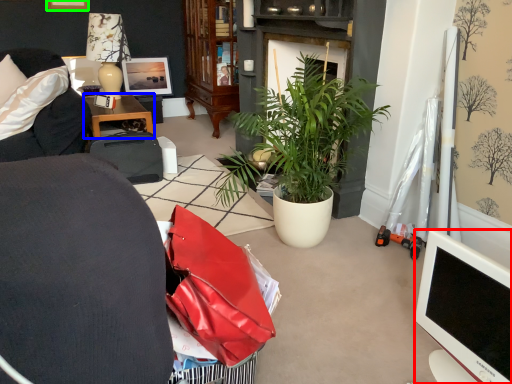
Question: Considering the real-world distances, which object is farthest from television (highlighted by a red box)? desk (highlighted by a blue box) or picture frame (highlighted by a green box)?

Choices:
 (A) desk
 (B) picture frame

Answer: (B)